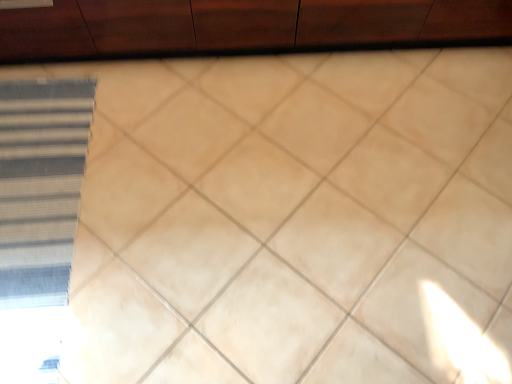
This screenshot has height=384, width=512. I want to click on vacant space behind textured beige curtain at left, so click(90, 110).